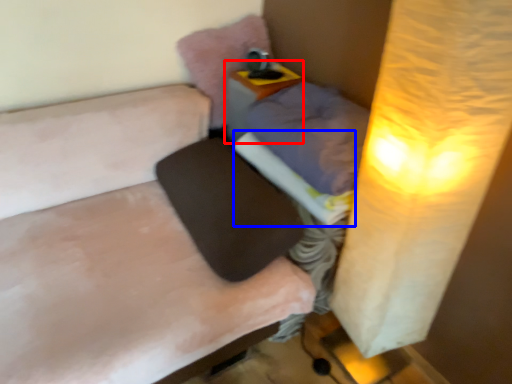
Question: Among these objects, which one is farthest to the camera, table (highlighted by a red box) or sheet (highlighted by a blue box)?

Choices:
 (A) table
 (B) sheet

Answer: (A)